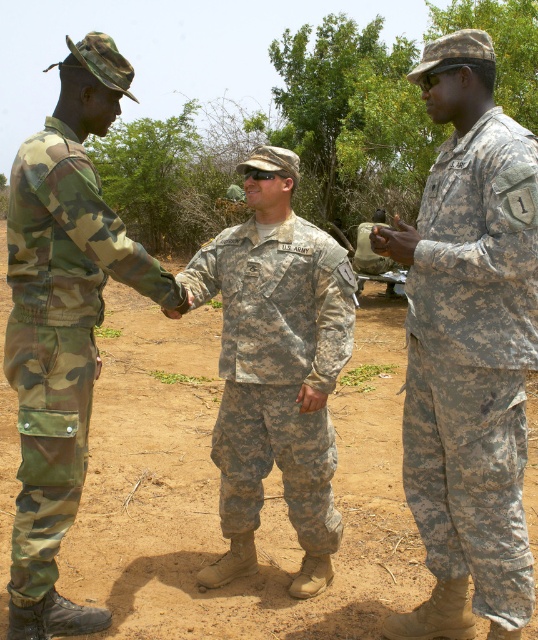
Question: Estimate the real-world distances between objects in this image. Which object is closer to the camo fabric uniform at left?

Choices:
 (A) camouflage fabric uniform at right
 (B) camouflage fabric uniform at center

Answer: (B)

Question: Among these points, which one is farthest from the camera?

Choices:
 (A) (282, 632)
 (B) (183, 278)

Answer: (B)

Question: Is dirt field at center positioned at the back of camouflage fabric uniform at center?

Choices:
 (A) yes
 (B) no

Answer: (B)

Question: Which point is farther from the camera taking this photo?

Choices:
 (A) tap(79, 580)
 (B) tap(508, 208)
 (C) tap(327, 240)

Answer: (A)

Question: Can you confirm if dirt field at center is wider than camo fabric uniform at left?

Choices:
 (A) yes
 (B) no

Answer: (A)

Question: Is dirt field at center further to camera compared to camouflage fabric uniform at right?

Choices:
 (A) yes
 (B) no

Answer: (A)